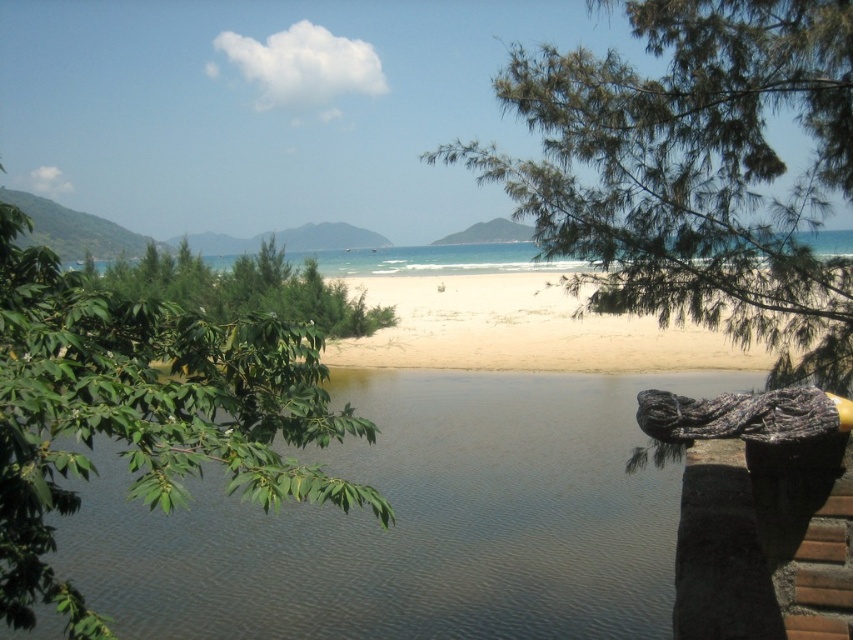
You are standing at the edge of the water in the coastal scene. You see two points marked in the image. Which point, point (x=631, y=99) or point (x=753, y=340), is closer to you?

Point (x=631, y=99) is closer to the viewer than point (x=753, y=340).

You are a photographer wanting to capture a sunset shot. You have a camera with a 50mm lens. The green leafy tree at left is blocking part of the horizon. Can you determine if the white sandy beach at center is tall enough to allow you to see the horizon without the tree blocking it?

The green leafy tree at left is shorter than the white sandy beach at center, so the white sandy beach at center is taller and may provide enough elevation to see over the tree. Move to the white sandy beach at center for a better view.